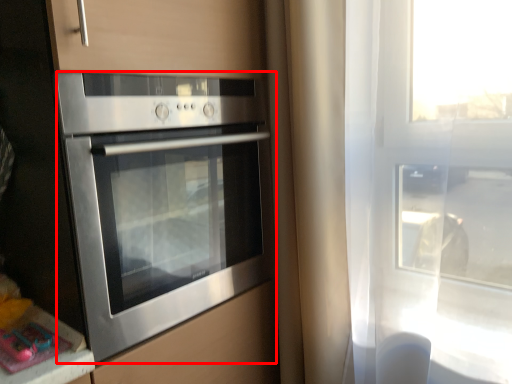
Question: From the image's perspective, what is the correct spatial relationship of oven (annotated by the red box) in relation to counter top?

Choices:
 (A) above
 (B) below

Answer: (A)